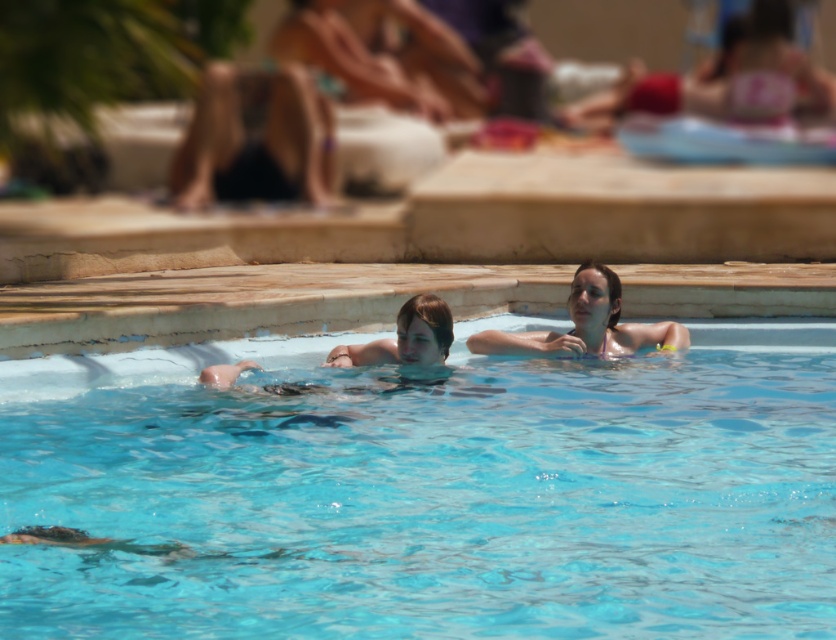
Can you confirm if transparent blue water at center is positioned to the right of smooth skin woman at center?

Indeed, transparent blue water at center is positioned on the right side of smooth skin woman at center.

How far apart are transparent blue water at center and smooth skin woman at center?

transparent blue water at center is 3.06 meters from smooth skin woman at center.

Find the location of `transparent blue water at center`. transparent blue water at center is located at coordinates (427, 492).